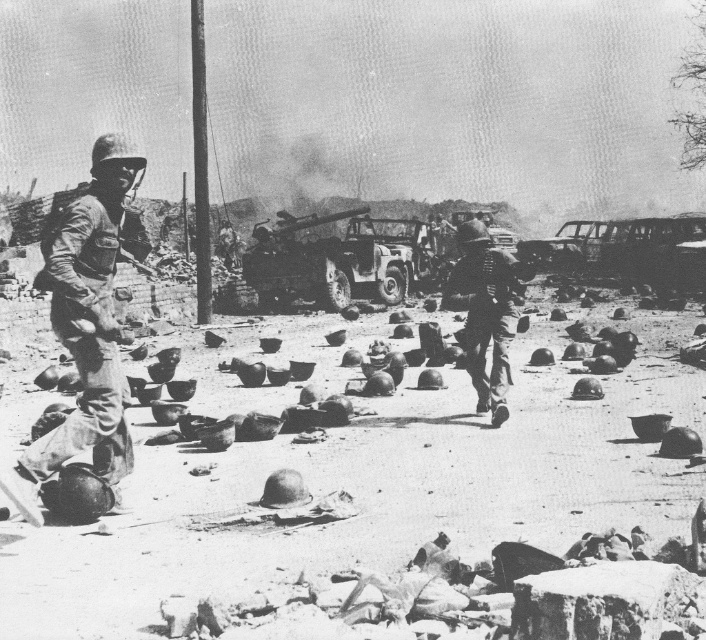
In the war scene, there are scattered military helmets and two soldiers moving away. The point at coordinates point (90, 317) is located on a metallic helmet at left. Based on the coordinates, can you determine which object the point is on?

The point at coordinates point (90, 317) is located on the metallic helmet at left.

You are a soldier in this war scene. You need to pick up a helmet to protect your head. Which metallic helmet between the metallic helmet at left and metallic helmet at center should you choose based on height?

The metallic helmet at left is much taller than the metallic helmet at center, so you should choose the metallic helmet at left for better head protection.

You are a soldier in this war zone. You need to carry a spare helmet and a tank part. The metallic helmet at left is smaller than the metallic matte tank at center. Which object should you choose to carry if you want the smaller one?

You should carry the metallic helmet at left because its width is less than the metallic matte tank at center, making it the smaller option.